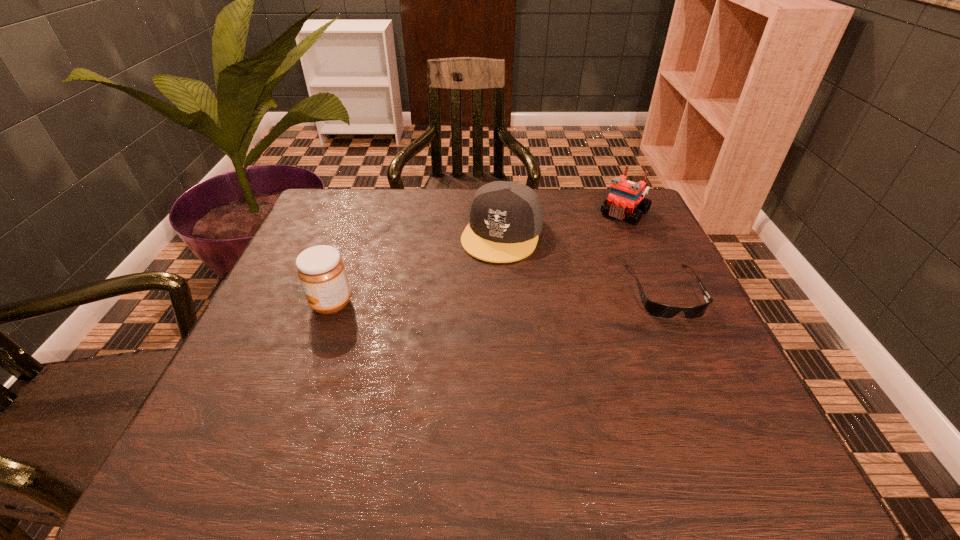
Identify the location of free space on the desktop that is between the jam and the shortest object and is positioned on the front-facing side of the cap. This screenshot has width=960, height=540. (470, 299).

Image resolution: width=960 pixels, height=540 pixels. Find the location of `free spot on the desktop that is between the jam and the sunglasses and is positioned on the front-facing side of the Lego`. free spot on the desktop that is between the jam and the sunglasses and is positioned on the front-facing side of the Lego is located at coordinates (549, 296).